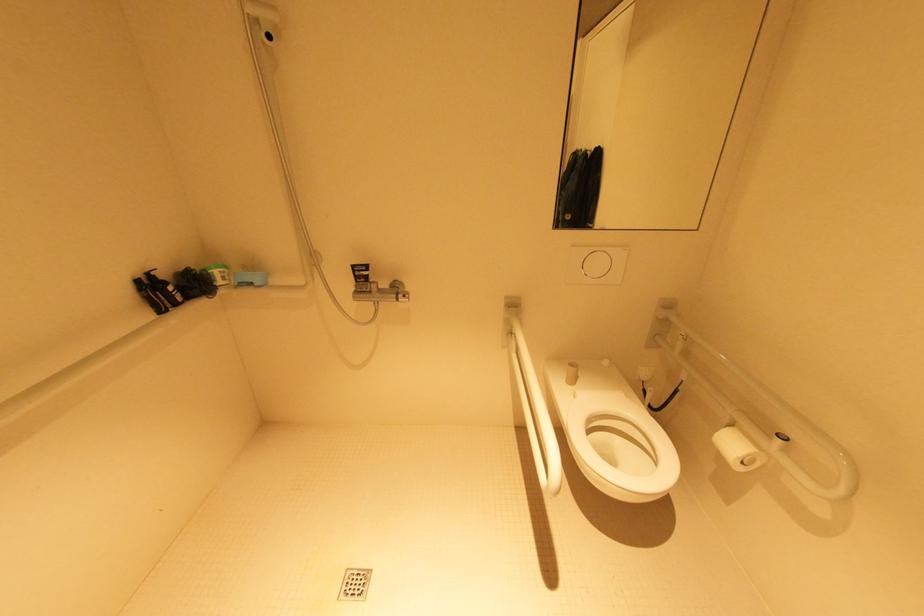
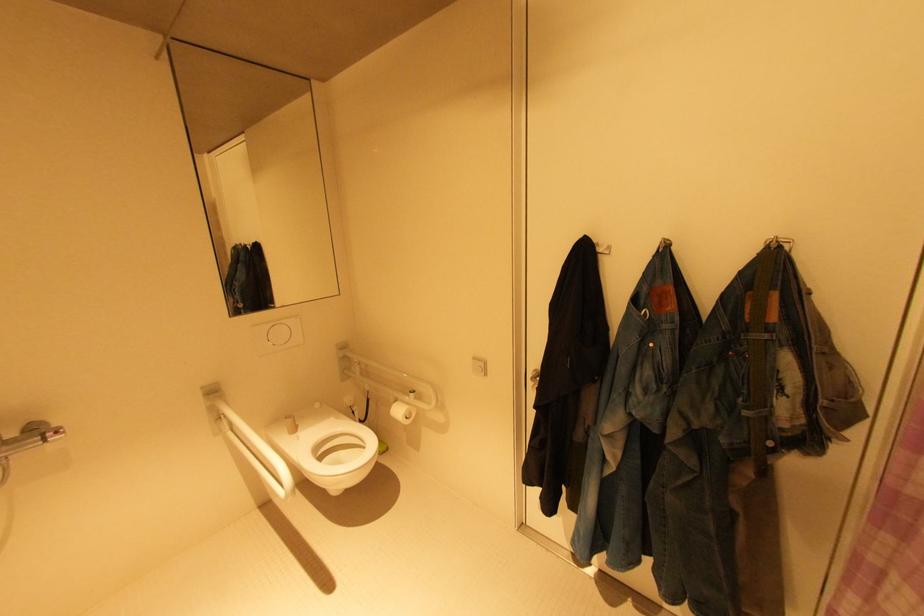
Question: How did the camera likely rotate?

Choices:
 (A) Left
 (B) Right
 (C) Up
 (D) Down

Answer: (B)